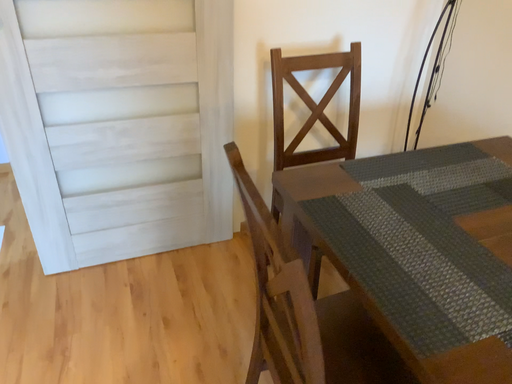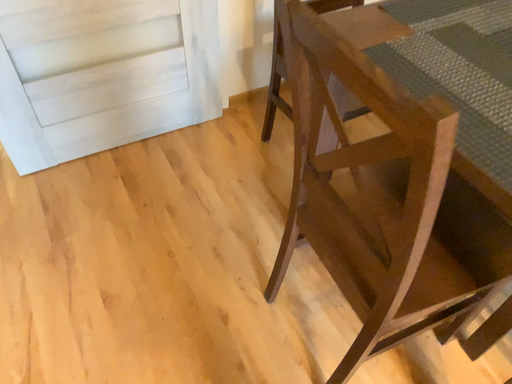
Question: How did the camera likely rotate when shooting the video?

Choices:
 (A) rotated left
 (B) rotated right

Answer: (B)